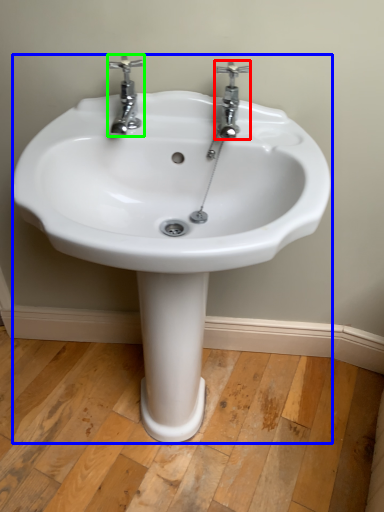
Question: Which object is the farthest from tap (highlighted by a red box)? Choose among these: sink (highlighted by a blue box) or tap (highlighted by a green box).

Choices:
 (A) sink
 (B) tap

Answer: (A)